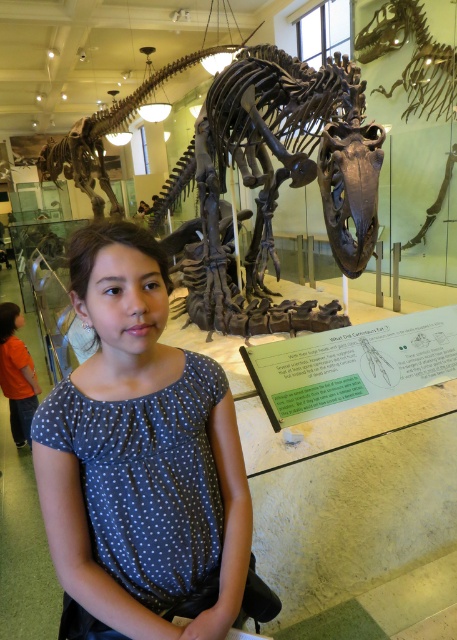
You are a visitor at the museum and want to take a photo of the shiny metallic dinosaur skeleton at center. The museum requires visitors to stay at least 1 meter away from all exhibits. If you are standing at the point where the informational sign is located, can you take the photo without moving closer than the required distance?

The question cannot be answered with the provided information because the spatial relationship between the visitor and the skeleton is not specified in the description.

You are a security guard in the museum and need to ensure visitors stay a minimum of 20 feet away from the shiny metallic skull at upper right. Is the polka dot fabric shirt at center currently within the required distance?

The polka dot fabric shirt at center is 21.21 feet away from the shiny metallic skull at upper right, so yes, it is within the required distance of 20 feet.

You are a visitor in the museum and want to take a photo of the shiny metallic dinosaur skeleton at center without any obstruction. Is the orange shirt at left blocking your view of the skeleton?

The shiny metallic dinosaur skeleton at center is taller than the orange shirt at left, so the orange shirt at left is not blocking the view of the skeleton.